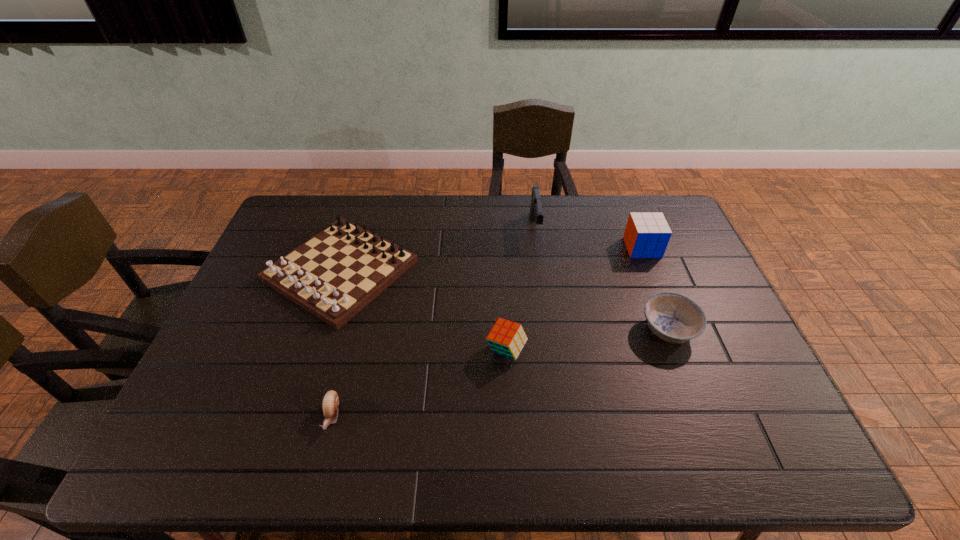
This screenshot has height=540, width=960. What are the coordinates of `the tallest object` in the screenshot? It's located at (536, 213).

Find the location of a particular element. the fourth object from left to right is located at coordinates (536, 213).

Find the location of `the farther cube`. the farther cube is located at coordinates (647, 234).

This screenshot has height=540, width=960. Identify the location of the third object from left to right. (506, 338).

Identify the location of the nearer cube. (506, 338).

This screenshot has width=960, height=540. Find the location of `chessboard`. chessboard is located at coordinates (335, 274).

You are a GUI agent. You are given a task and a screenshot of the screen. Output one action in this format:
    pyautogui.click(x=<x>, y=<y>)
    Task: Click on the bowl
    This screenshot has width=960, height=540.
    Given the screenshot: What is the action you would take?
    pyautogui.click(x=672, y=317)

Locate an element on the screen. the nearest object is located at coordinates (330, 403).

Locate an element on the screen. the shortest object is located at coordinates (330, 403).

Locate an element on the screen. The width and height of the screenshot is (960, 540). vacant point located 0.350m aim along the barrel of the third object from right to left is located at coordinates (549, 327).